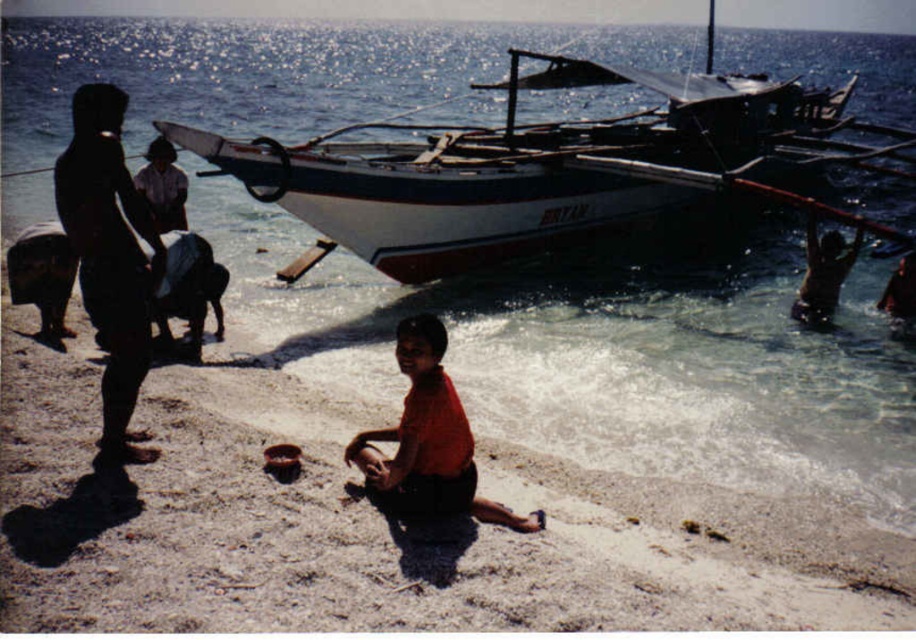
Between white wooden boat at upper center and dark matte clothing at left, which one is positioned higher?

white wooden boat at upper center is above.

Between white wooden boat at upper center and dark matte clothing at left, which one is positioned lower?

dark matte clothing at left

Locate an element on the screen. The height and width of the screenshot is (640, 916). white wooden boat at upper center is located at coordinates (544, 164).

Can you confirm if matte orange shirt at center is positioned to the left of white cotton shirt at center?

Incorrect, matte orange shirt at center is not on the left side of white cotton shirt at center.

Which of these two, matte orange shirt at center or white cotton shirt at center, stands taller?

matte orange shirt at center

I want to click on matte orange shirt at center, so click(429, 440).

Is dark matte clothing at left to the right of white cotton shirt at center from the viewer's perspective?

Correct, you'll find dark matte clothing at left to the right of white cotton shirt at center.

Does dark matte clothing at left have a smaller size compared to white cotton shirt at center?

Correct, dark matte clothing at left occupies less space than white cotton shirt at center.

Is point (102, 307) positioned before point (156, 200)?

Yes, it is.

The height and width of the screenshot is (640, 916). What are the coordinates of `dark matte clothing at left` in the screenshot? It's located at (108, 257).